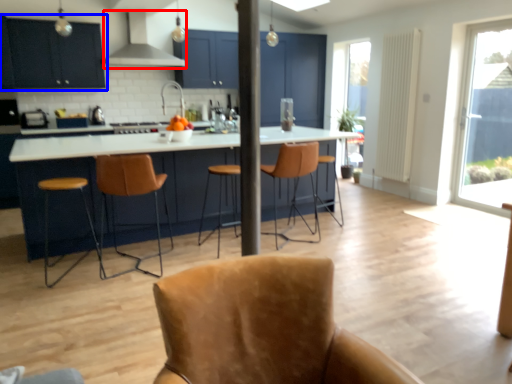
Question: Which object appears closest to the camera in this image, exhaust hood (highlighted by a red box) or cabinetry (highlighted by a blue box)?

Choices:
 (A) exhaust hood
 (B) cabinetry

Answer: (B)